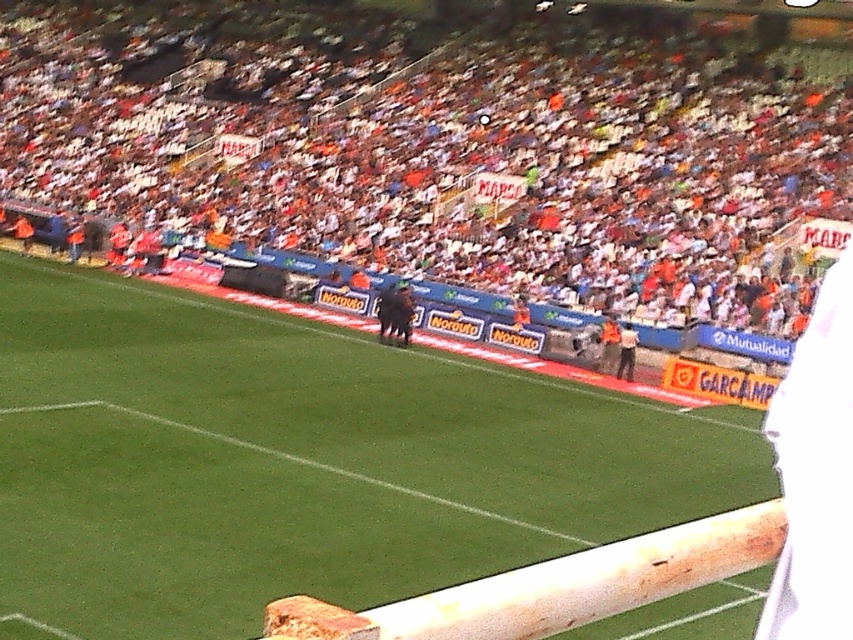
You are a drone operator trying to capture a photo of the green grass football field at center. However, there is an orange fabric crowd at upper center blocking your view. Can you determine if the crowd is above or below the field?

The orange fabric crowd at upper center is positioned over the green grass football field at center, so the crowd is above the field.

You are a photographer trying to capture a photo of the white fabric shirt at right without the orange fabric crowd at upper center blocking it. What should you do?

Move your camera position downward to avoid the orange fabric crowd at upper center, which is above the white fabric shirt at right.

You are a spectator at the soccer stadium and notice the green grass football field at center and the white fabric shirt at right. Which object is closer to the ground?

The green grass football field at center is positioned under the white fabric shirt at right, meaning it is closer to the ground.